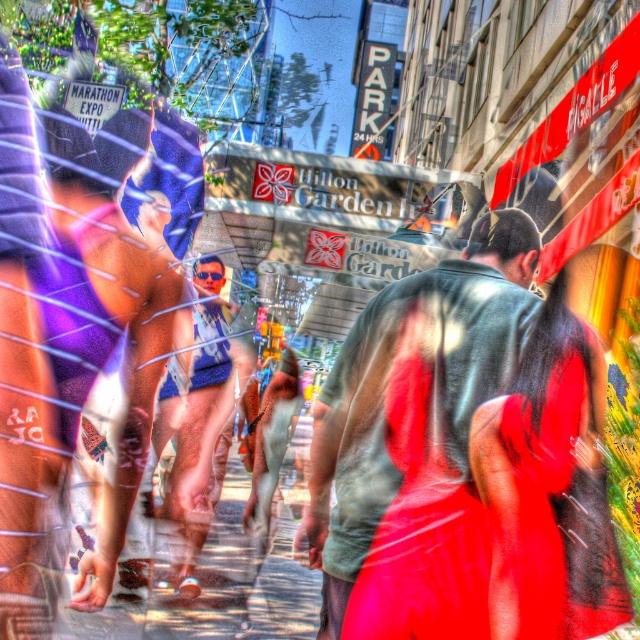
Question: Can you confirm if green fabric shirt at center is wider than smooth concrete sidewalk at center?

Choices:
 (A) yes
 (B) no

Answer: (A)

Question: Is green fabric shirt at center below smooth concrete sidewalk at center?

Choices:
 (A) no
 (B) yes

Answer: (A)

Question: Does green fabric shirt at center appear on the left side of smooth concrete sidewalk at center?

Choices:
 (A) no
 (B) yes

Answer: (A)